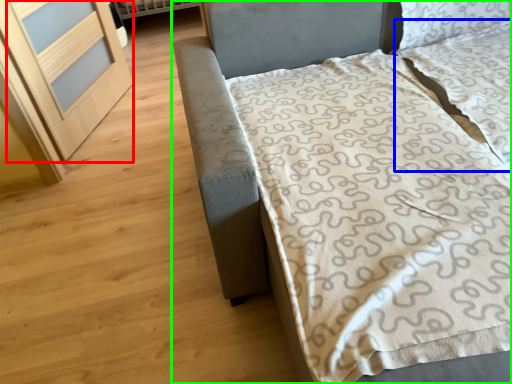
Question: Based on their relative distances, which object is farther from screen door (highlighted by a red box)? Choose from pillow (highlighted by a blue box) and bed (highlighted by a green box).

Choices:
 (A) pillow
 (B) bed

Answer: (A)